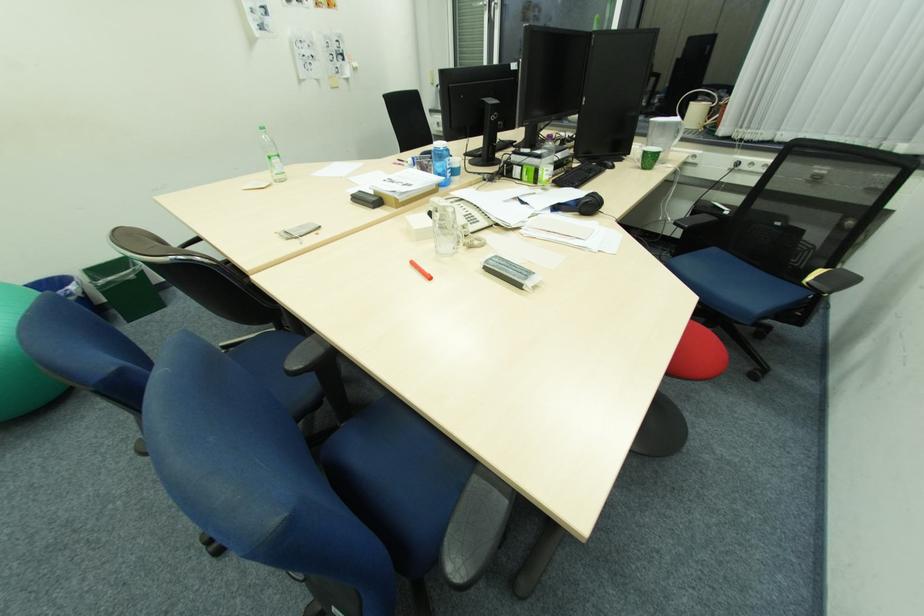
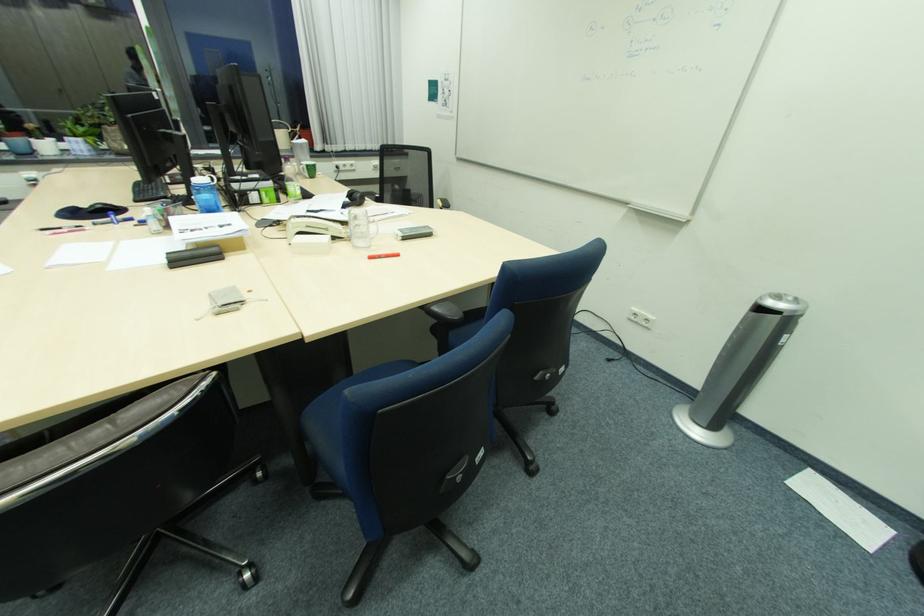
Locate, in the second image, the point that corresponds to [418,264] in the first image.

(377, 257)